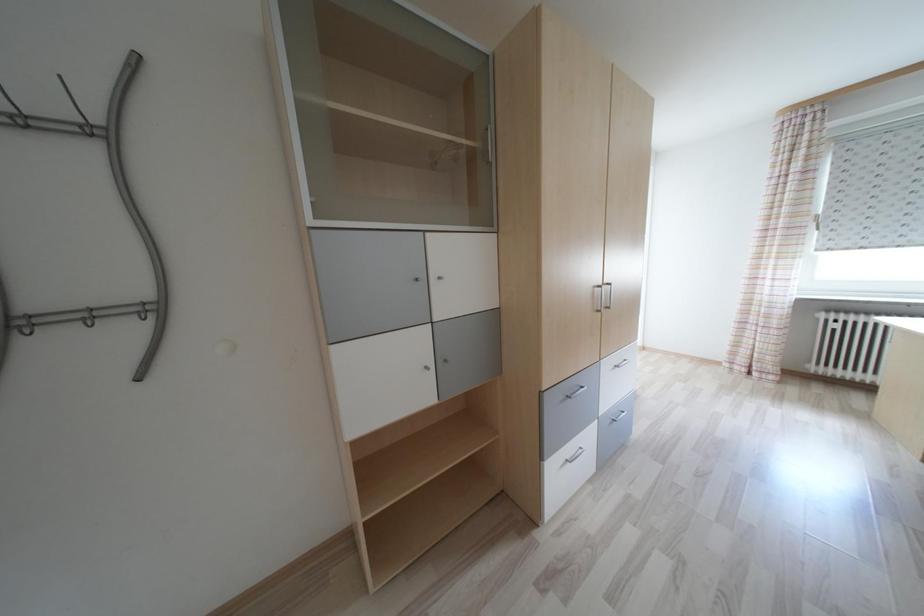
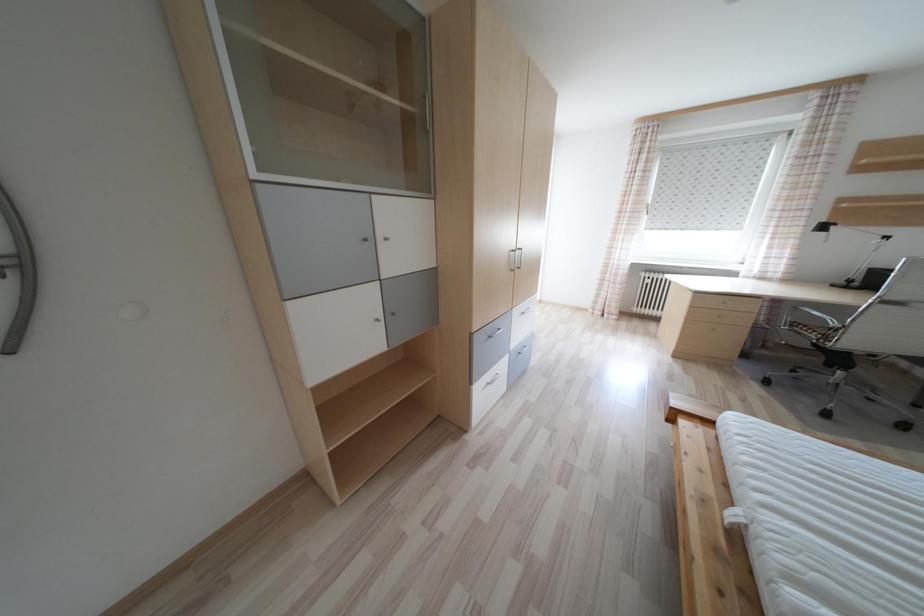
In a continuous first-person perspective shot, in which direction is the camera moving?

The cameraman moved toward left, backward.